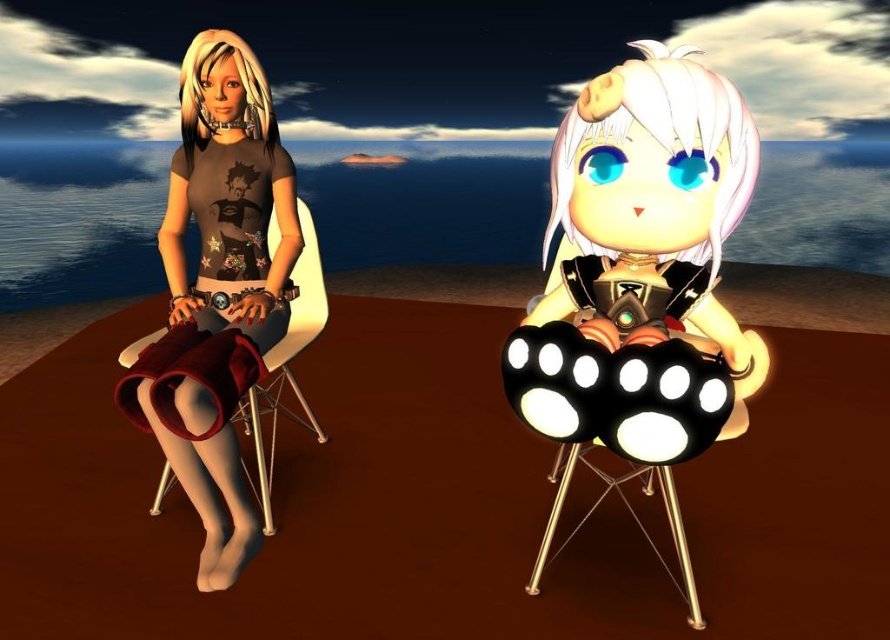
Is shiny black paw pads at center to the left of white plastic chair at left from the viewer's perspective?

Incorrect, shiny black paw pads at center is not on the left side of white plastic chair at left.

Which is above, shiny black paw pads at center or white plastic chair at left?

shiny black paw pads at center is higher up.

Locate an element on the screen. The width and height of the screenshot is (890, 640). shiny black paw pads at center is located at coordinates (654, 244).

Where is `shiny black paw pads at center`? This screenshot has width=890, height=640. shiny black paw pads at center is located at coordinates (654, 244).

Is shiny black paw pads at center above metallic gold stool at right?

Yes, shiny black paw pads at center is above metallic gold stool at right.

Can you confirm if shiny black paw pads at center is smaller than metallic gold stool at right?

No, shiny black paw pads at center is not smaller than metallic gold stool at right.

Describe the element at coordinates (654, 244) in the screenshot. The width and height of the screenshot is (890, 640). I see `shiny black paw pads at center` at that location.

The width and height of the screenshot is (890, 640). Find the location of `shiny black paw pads at center`. shiny black paw pads at center is located at coordinates (654, 244).

Does point (271, 435) come in front of point (678, 557)?

No, it is not.

Does point (267, 353) come farther from viewer compared to point (638, 467)?

Yes.

Locate an element on the screen. white plastic chair at left is located at coordinates (289, 355).

Image resolution: width=890 pixels, height=640 pixels. What are the coordinates of `white plastic chair at left` in the screenshot? It's located at (289, 355).